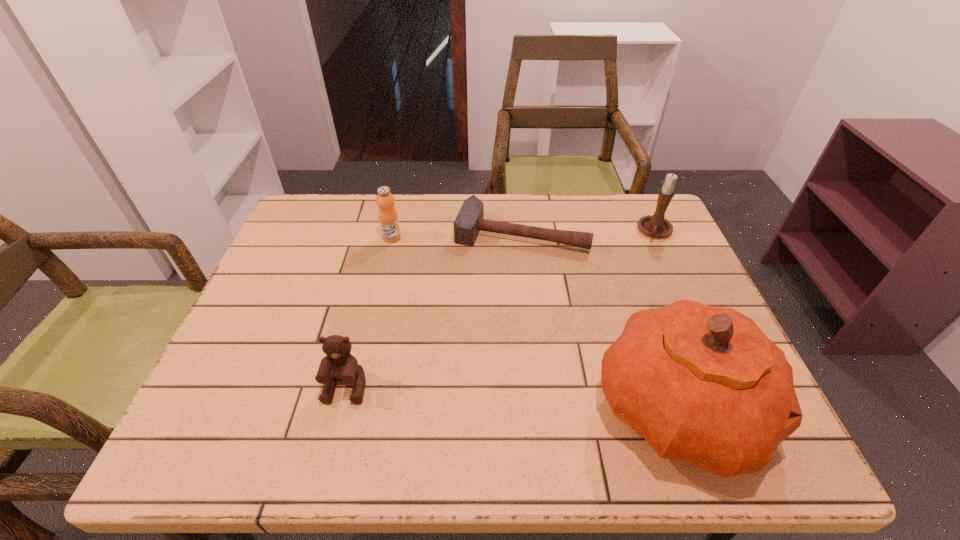
I want to click on the second shortest object, so click(x=339, y=365).

This screenshot has width=960, height=540. I want to click on the tallest object, so click(x=702, y=384).

This screenshot has height=540, width=960. I want to click on candle holder, so pyautogui.click(x=656, y=226).

Find the location of a particular element. The image size is (960, 540). orange juice is located at coordinates (388, 218).

Find the location of a particular element. the shortest object is located at coordinates (470, 220).

At what (x,y) coordinates should I click in order to perform the action: click on free region located on the side of the candle holder with the handle. Please return your answer as a coordinate pair (x, y). This screenshot has width=960, height=540. Looking at the image, I should click on (632, 275).

Locate an element on the screen. This screenshot has height=540, width=960. vacant space located on the side of the candle holder with the handle is located at coordinates (620, 293).

The width and height of the screenshot is (960, 540). I want to click on blank space located 0.340m on the side of the candle holder with the handle, so click(x=606, y=318).

At what (x,y) coordinates should I click in order to perform the action: click on free spot located 0.150m on the front label of the orange juice. Please return your answer as a coordinate pair (x, y). Looking at the image, I should click on (x=422, y=272).

At what (x,y) coordinates should I click in order to perform the action: click on blank area located 0.100m on the front label of the orange juice. Please return your answer as a coordinate pair (x, y). Looking at the image, I should click on (414, 261).